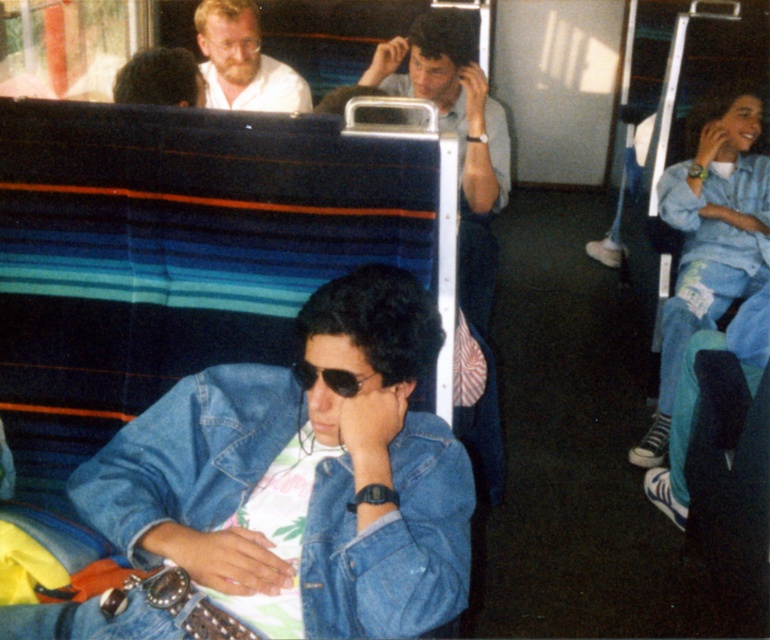
Is faded denim jacket at lower right above denim jacket at upper right?

No.

Which is behind, point (310, 461) or point (755, 275)?

Positioned behind is point (755, 275).

Is point (288, 465) positioned after point (735, 232)?

That is False.

Identify the location of faded denim jacket at lower right. The width and height of the screenshot is (770, 640). (303, 476).

Where is `faded denim jacket at lower right`? faded denim jacket at lower right is located at coordinates (303, 476).

Which is in front, point (192, 532) or point (275, 99)?

Point (192, 532) is more forward.

Does point (226, 435) come farther from viewer compared to point (233, 19)?

No, (226, 435) is closer to viewer.

This screenshot has height=640, width=770. Identify the location of faded denim jacket at lower right. (303, 476).

Which is above, denim jacket at upper right or bearded man at upper left?

bearded man at upper left

Where is `denim jacket at upper right`? The image size is (770, 640). denim jacket at upper right is located at coordinates (708, 234).

At what (x,y) coordinates should I click in order to perform the action: click on denim jacket at upper right. Please return your answer as a coordinate pair (x, y). Looking at the image, I should click on (708, 234).